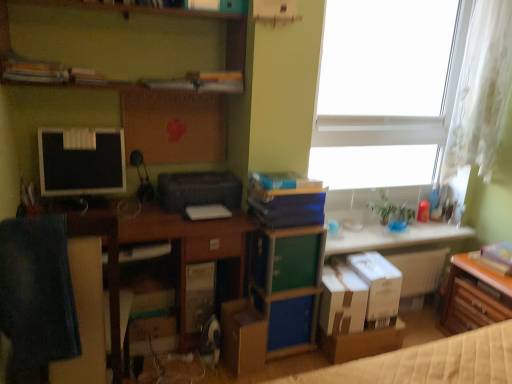
Question: Is matte black monitor at left spatially inside blue hardcover book at center, which ranks as the third book in left-to-right order, or outside of it?

Choices:
 (A) outside
 (B) inside

Answer: (A)

Question: From a real-world perspective, is matte black monitor at left physically located above or below blue hardcover book at center, which appears as the second book when viewed from the right?

Choices:
 (A) below
 (B) above

Answer: (B)

Question: Which of these objects is positioned farthest from the brown cardboard box at lower right, acting as the 1th cardboard box starting from the right?

Choices:
 (A) blue fabric box at center
 (B) brown cardboard box at center, arranged as the 1th cardboard box when viewed from the left
 (C) wooden desk at lower left
 (D) black plastic printer at center
 (E) white matte book at center, acting as the 4th book starting from the top

Answer: (D)

Question: Which is nearer to the white cardboard box at lower center, the third cardboard box viewed from the left?

Choices:
 (A) white glossy table at center, arranged as the 2th table when ordered from the bottom
 (B) hardcover book at upper left, which appears as the fourth book when viewed from the right
 (C) green matte file cabinet at center
 (D) brown cardboard box at center, arranged as the 1th cardboard box when viewed from the left
 (E) blue matte book at center, acting as the second book starting from the top

Answer: (C)